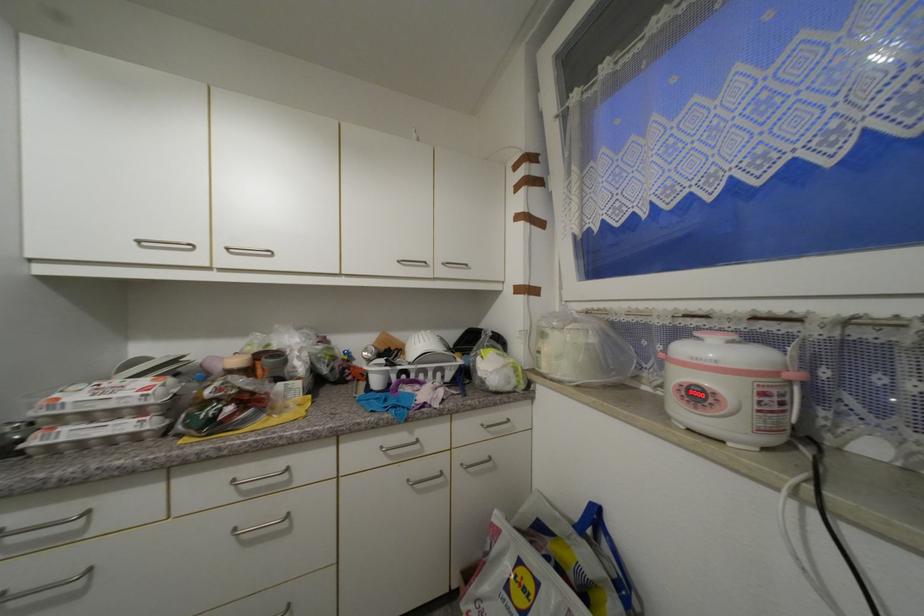
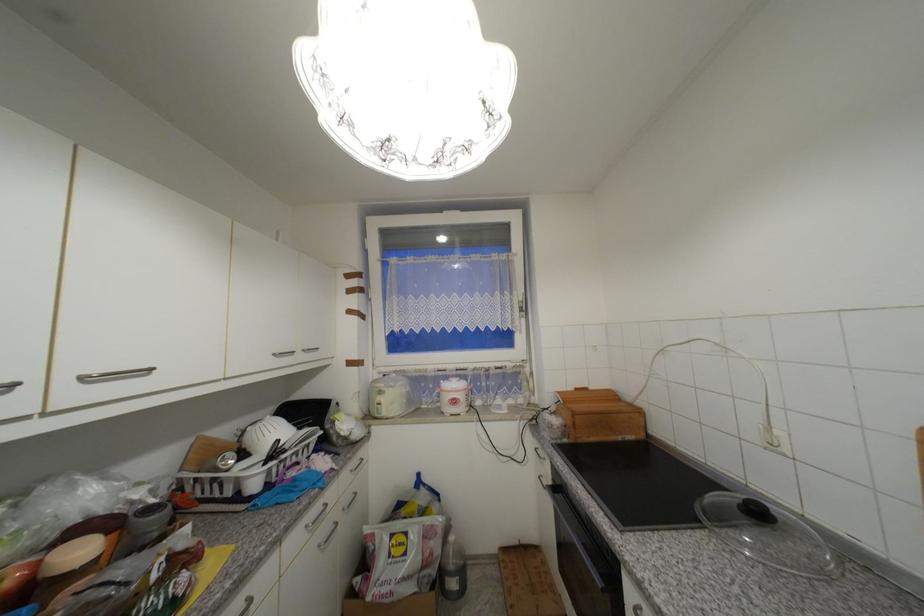
Find the pixel in the second image that matches point (423, 469) in the first image.

(330, 531)